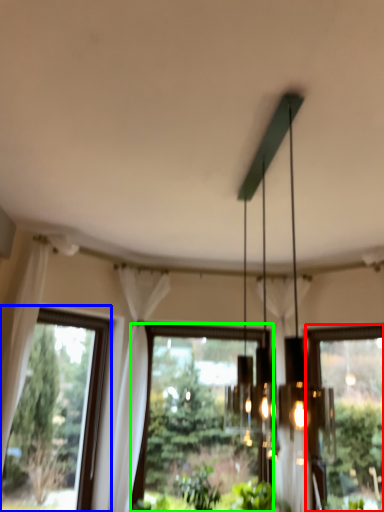
Question: Considering the real-world distances, which object is farthest from window (highlighted by a red box)? window (highlighted by a blue box) or window (highlighted by a green box)?

Choices:
 (A) window
 (B) window

Answer: (A)